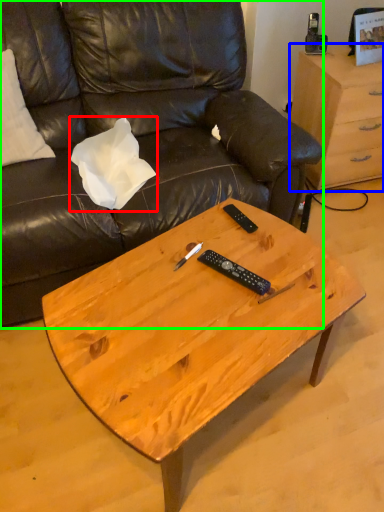
Question: Considering the real-world distances, which object is farthest from pillow (highlighted by a red box)? desk (highlighted by a blue box) or studio couch (highlighted by a green box)?

Choices:
 (A) desk
 (B) studio couch

Answer: (A)